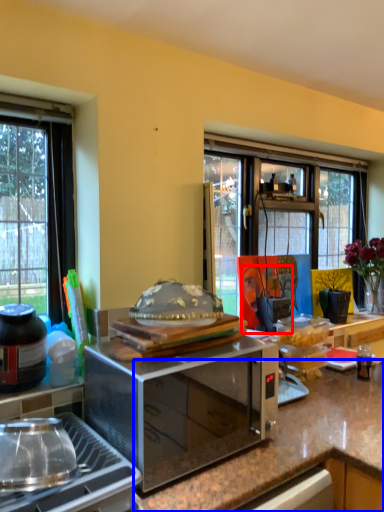
Question: Which of the following is the farthest to the observer, person (highlighted by a red box) or countertop (highlighted by a blue box)?

Choices:
 (A) person
 (B) countertop

Answer: (A)